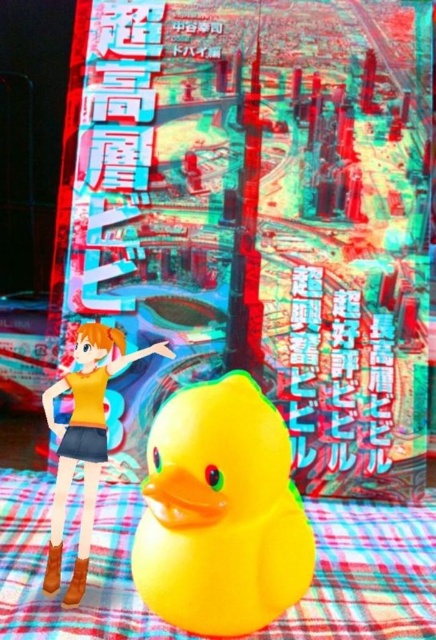
Question: Does yellow rubber duck at center appear on the right side of matte yellow rubber duck at lower center?

Choices:
 (A) yes
 (B) no

Answer: (A)

Question: Can you confirm if yellow rubber duck at center is thinner than matte yellow rubber duck at lower center?

Choices:
 (A) yes
 (B) no

Answer: (B)

Question: In this image, where is yellow rubber duck at center located relative to matte yellow rubber duck at lower center?

Choices:
 (A) below
 (B) above

Answer: (A)

Question: Which point is closer to the camera taking this photo?

Choices:
 (A) (245, 541)
 (B) (99, 403)

Answer: (A)